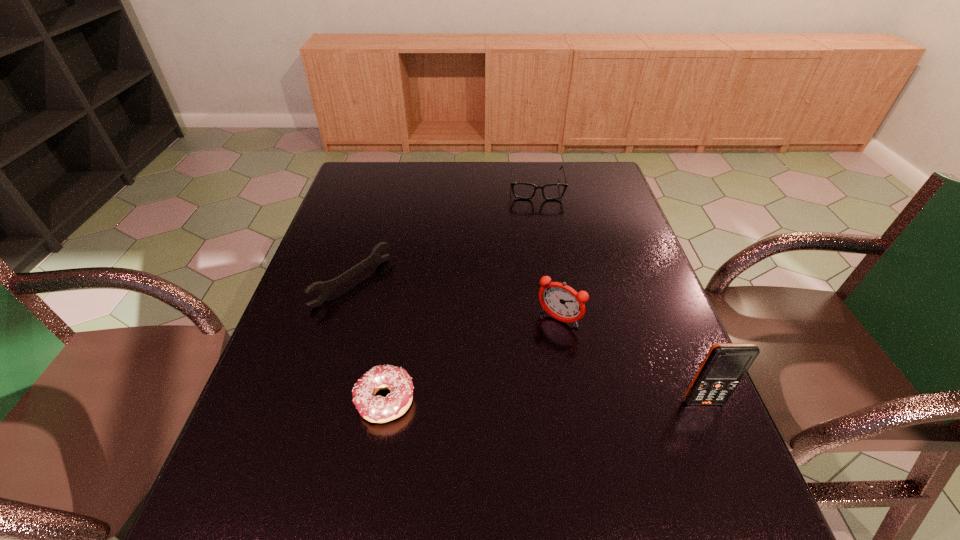
At what (x,y) coordinates should I click in order to perform the action: click on free spot on the desktop that is between the doughnut and the rightmost object and is positioned on the front-facing side of the second tallest object. Please return your answer as a coordinate pair (x, y). This screenshot has height=540, width=960. Looking at the image, I should click on (504, 401).

The height and width of the screenshot is (540, 960). Find the location of `free spot on the desktop that is between the doughnut and the cellular telephone and is positioned on the front-facing side of the spectacles`. free spot on the desktop that is between the doughnut and the cellular telephone and is positioned on the front-facing side of the spectacles is located at coordinates (554, 401).

Identify the location of vacant spot on the desktop that is between the doughnut and the tallest object and is positioned on the open ends of the wrench. Image resolution: width=960 pixels, height=540 pixels. (523, 401).